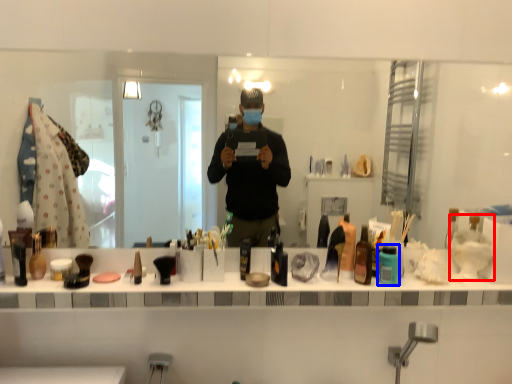
Question: Which of the following is the closest to the observer, shaving cream (highlighted by a red box) or toiletry (highlighted by a blue box)?

Choices:
 (A) shaving cream
 (B) toiletry

Answer: (B)